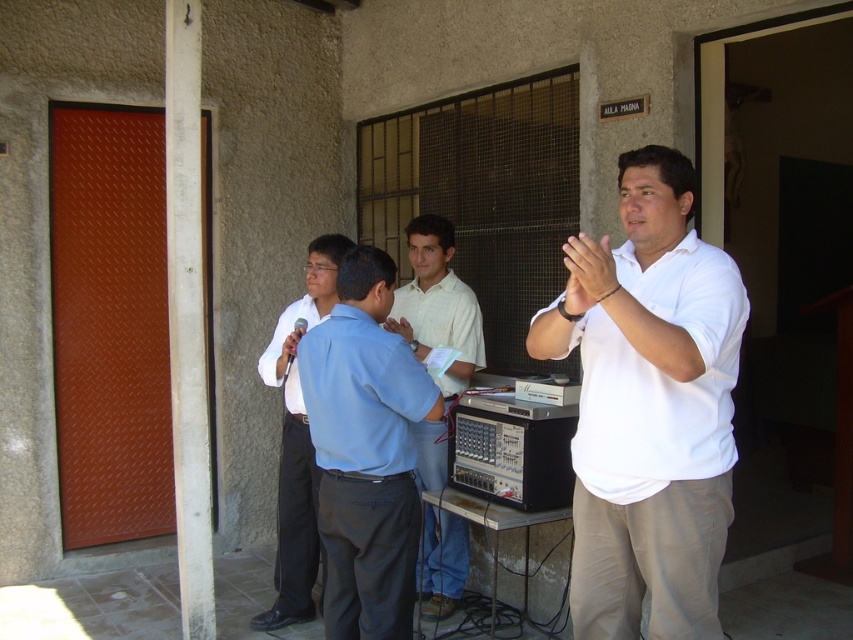
Between point (425, 317) and point (289, 438), which one is positioned behind?

Positioned behind is point (425, 317).

Find the location of a particular element. The image size is (853, 640). white smooth shirt at center is located at coordinates (437, 304).

Is white matte shirt at center to the right of white smooth shirt at center from the viewer's perspective?

Correct, you'll find white matte shirt at center to the right of white smooth shirt at center.

Can you confirm if white matte shirt at center is positioned below white smooth shirt at center?

No, white matte shirt at center is not below white smooth shirt at center.

This screenshot has height=640, width=853. What are the coordinates of `white matte shirt at center` in the screenshot? It's located at (648, 406).

Is point (602, 394) positioned in front of point (345, 371)?

That is True.

Does white matte shirt at center appear over light blue shirt at center?

Yes, white matte shirt at center is above light blue shirt at center.

This screenshot has height=640, width=853. What do you see at coordinates (648, 406) in the screenshot? I see `white matte shirt at center` at bounding box center [648, 406].

Locate an element on the screen. Image resolution: width=853 pixels, height=640 pixels. white matte shirt at center is located at coordinates (648, 406).